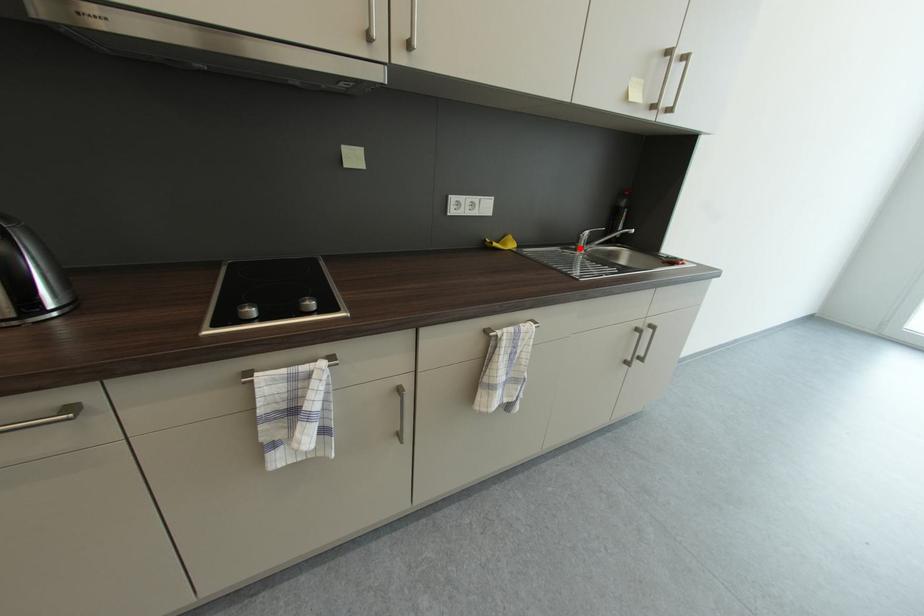
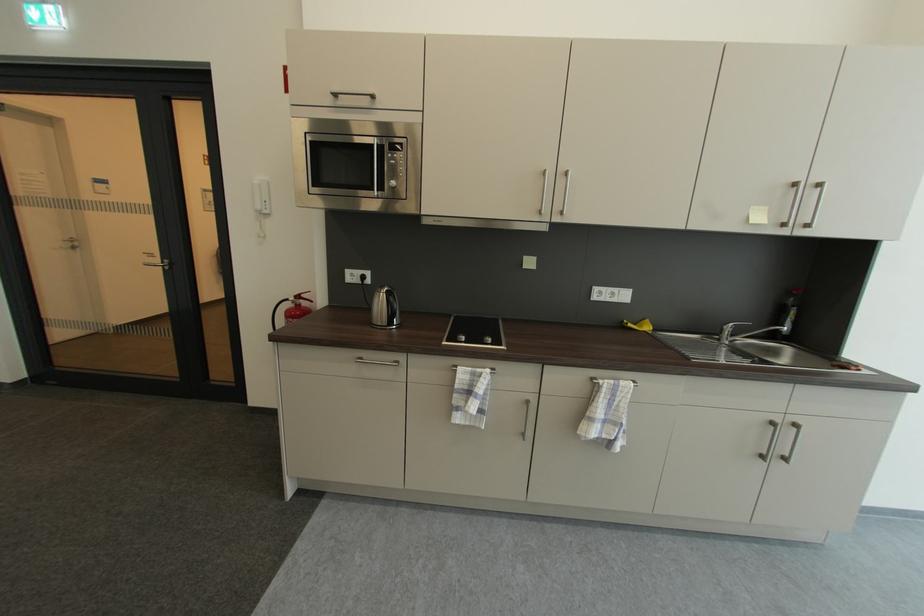
Find the pixel in the second image that matches the highlighted location in the first image.

(723, 339)